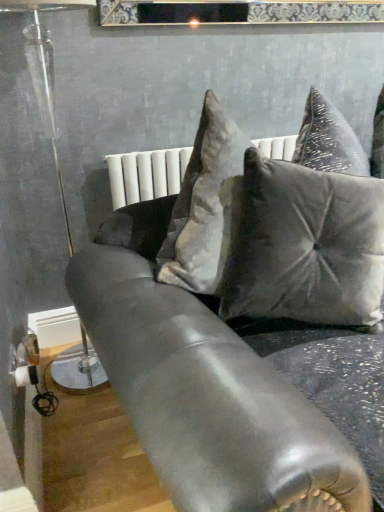
Question: Is clear glass lamp at left to the right of satin gray pillow at center from the viewer's perspective?

Choices:
 (A) yes
 (B) no

Answer: (B)

Question: Is clear glass lamp at left thinner than satin gray pillow at center?

Choices:
 (A) yes
 (B) no

Answer: (B)

Question: Does clear glass lamp at left have a greater width compared to satin gray pillow at center?

Choices:
 (A) yes
 (B) no

Answer: (A)

Question: Does clear glass lamp at left lie in front of satin gray pillow at center?

Choices:
 (A) yes
 (B) no

Answer: (B)

Question: Can you confirm if clear glass lamp at left is shorter than satin gray pillow at center?

Choices:
 (A) yes
 (B) no

Answer: (B)

Question: Is point (26, 55) positioned closer to the camera than point (306, 169)?

Choices:
 (A) closer
 (B) farther

Answer: (B)

Question: Is clear glass lamp at left spatially inside satin gray pillow at center, or outside of it?

Choices:
 (A) outside
 (B) inside

Answer: (A)

Question: Is clear glass lamp at left bigger or smaller than satin gray pillow at center?

Choices:
 (A) small
 (B) big

Answer: (B)

Question: Looking at their shapes, would you say clear glass lamp at left is wider or thinner than satin gray pillow at center?

Choices:
 (A) thin
 (B) wide

Answer: (B)

Question: Considering the positions of satin black couch at center and clear glass lamp at left in the image, is satin black couch at center taller or shorter than clear glass lamp at left?

Choices:
 (A) tall
 (B) short

Answer: (B)

Question: Does point (157, 378) appear closer or farther from the camera than point (26, 4)?

Choices:
 (A) farther
 (B) closer

Answer: (B)

Question: Is satin black couch at center inside the boundaries of clear glass lamp at left, or outside?

Choices:
 (A) inside
 (B) outside

Answer: (B)

Question: Is satin black couch at center to the left or to the right of clear glass lamp at left in the image?

Choices:
 (A) right
 (B) left

Answer: (A)

Question: From the image's perspective, is satin gray pillow at center above or below satin black couch at center?

Choices:
 (A) above
 (B) below

Answer: (A)

Question: Is point (269, 202) positioned closer to the camera than point (210, 382)?

Choices:
 (A) closer
 (B) farther

Answer: (B)